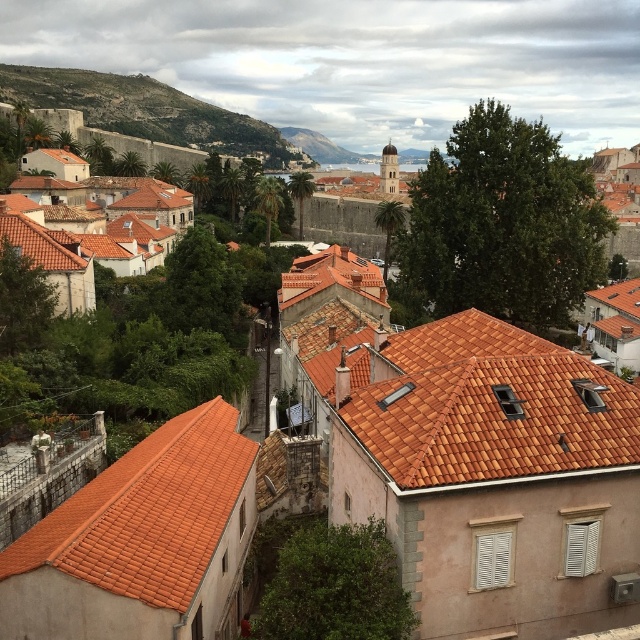
Question: Does terracotta tile roof at lower left have a lesser width compared to green grassy hillside at upper left?

Choices:
 (A) no
 (B) yes

Answer: (B)

Question: Does terracotta tile roof at lower left appear on the left side of green grassy hillside at upper left?

Choices:
 (A) yes
 (B) no

Answer: (B)

Question: Which object appears closest to the camera in this image?

Choices:
 (A) terracotta tile roof at lower left
 (B) green grassy hillside at upper left

Answer: (A)

Question: Can you confirm if terracotta tile roof at lower left is positioned to the right of green grassy hillside at upper left?

Choices:
 (A) yes
 (B) no

Answer: (A)